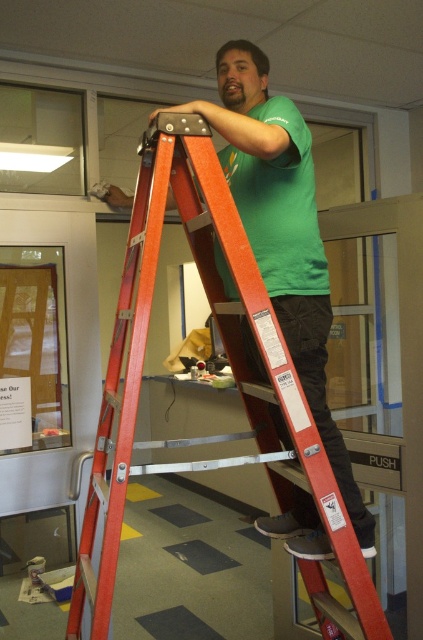
You are a safety inspector checking the workspace. The orange metallic ladder at center is in use by a worker. According to safety guidelines, the minimum safe distance between a ladder and the camera position should be 5 feet to avoid obstruction. Is the current distance compliant?

The distance between the orange metallic ladder at center and the camera is 4.53 feet, which is less than the required 5 feet. Therefore, the current setup does not comply with safety guidelines.

You are a maintenance worker in an office and need to access a high shelf that is 1.8 meters tall. You see the orange metallic ladder at center. Is the ladder tall enough to reach the shelf?

The orange metallic ladder at center is positioned at point (231, 369). Since the ladder is a step ladder with metal rungs and a sturdy frame, it is likely tall enough to reach the 1.8 meters high shelf. However, without specific height information, we can infer based on standard step ladder dimensions that it might be sufficient.

You are a maintenance worker needing to reach a high shelf in the office. You see an orange metallic ladder at center and a wooden bulletin board at left. Which object can help you reach the higher position?

The orange metallic ladder at center is taller than the wooden bulletin board at left, so it can help you reach the higher position.